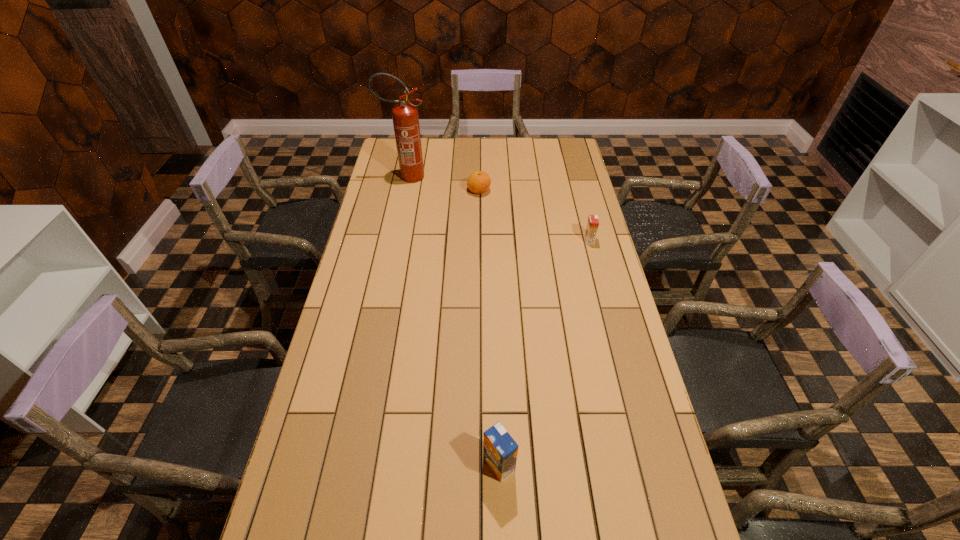
The width and height of the screenshot is (960, 540). I want to click on free space that is in between the third nearest object and the second shortest object, so click(x=534, y=215).

The image size is (960, 540). Identify the location of unoccupied position between the farther orange juice and the left orange juice. (544, 352).

Where is `free area in between the shorter orange juice and the third shortest object`? Image resolution: width=960 pixels, height=540 pixels. free area in between the shorter orange juice and the third shortest object is located at coordinates (544, 352).

Where is `vacant area that lies between the third nearest object and the fire extinguisher`? This screenshot has height=540, width=960. vacant area that lies between the third nearest object and the fire extinguisher is located at coordinates (443, 184).

Where is `free space between the second farthest object and the rightmost object`? free space between the second farthest object and the rightmost object is located at coordinates (534, 215).

At what (x,y) coordinates should I click in order to perform the action: click on vacant space that's between the farther orange juice and the left orange juice. Please return your answer as a coordinate pair (x, y). This screenshot has height=540, width=960. Looking at the image, I should click on (544, 352).

In order to click on free spot between the leftmost object and the left orange juice in this screenshot , I will do `click(453, 321)`.

Where is `free space between the leftmost object and the nearer orange juice`? Image resolution: width=960 pixels, height=540 pixels. free space between the leftmost object and the nearer orange juice is located at coordinates (453, 321).

Find the location of `the closest object relative to the rightmost object`. the closest object relative to the rightmost object is located at coordinates (478, 182).

Identify which object is the closest to the second farthest object. Please provide its 2D coordinates. Your answer should be formatted as a tuple, i.e. [(x, y)], where the tuple contains the x and y coordinates of a point satisfying the conditions above.

[(405, 117)]